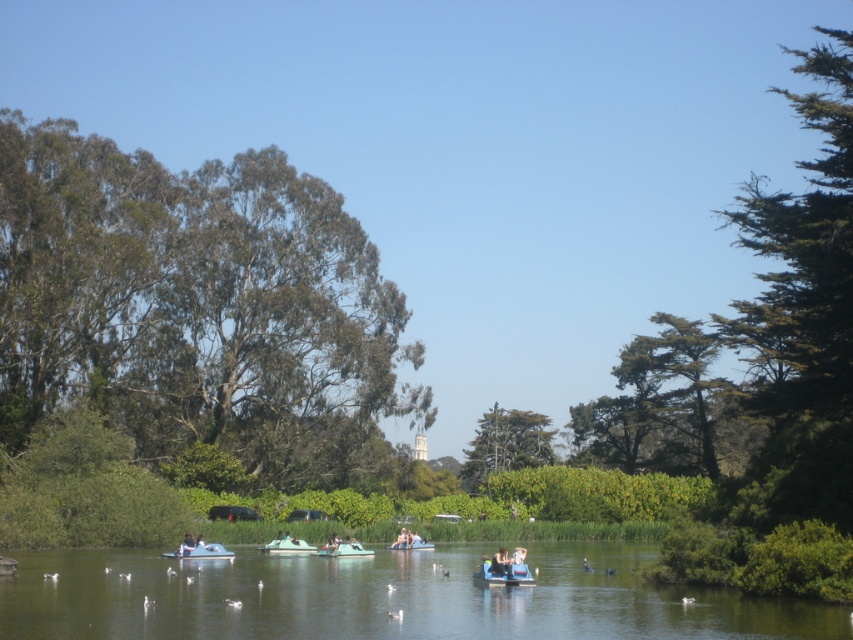
Question: Is green leafy tree at upper right positioned at the back of green textured tree at center?

Choices:
 (A) no
 (B) yes

Answer: (A)

Question: Which point is closer to the camera taking this photo?

Choices:
 (A) (286, 554)
 (B) (268, 365)

Answer: (A)

Question: Can you confirm if green leafy tree at upper left is positioned below green needle-like foliage at upper right?

Choices:
 (A) no
 (B) yes

Answer: (B)

Question: Which point is closer to the camera taking this photo?

Choices:
 (A) (339, 580)
 (B) (277, 550)

Answer: (A)

Question: Considering the real-world distances, which object is farthest from the matte blue paddleboat at center?

Choices:
 (A) blue plastic boat at center
 (B) matte green boat at center
 (C) light blue plastic boat at center

Answer: (A)

Question: Does blue plastic boat at center have a larger size compared to matte green boat at center?

Choices:
 (A) no
 (B) yes

Answer: (A)